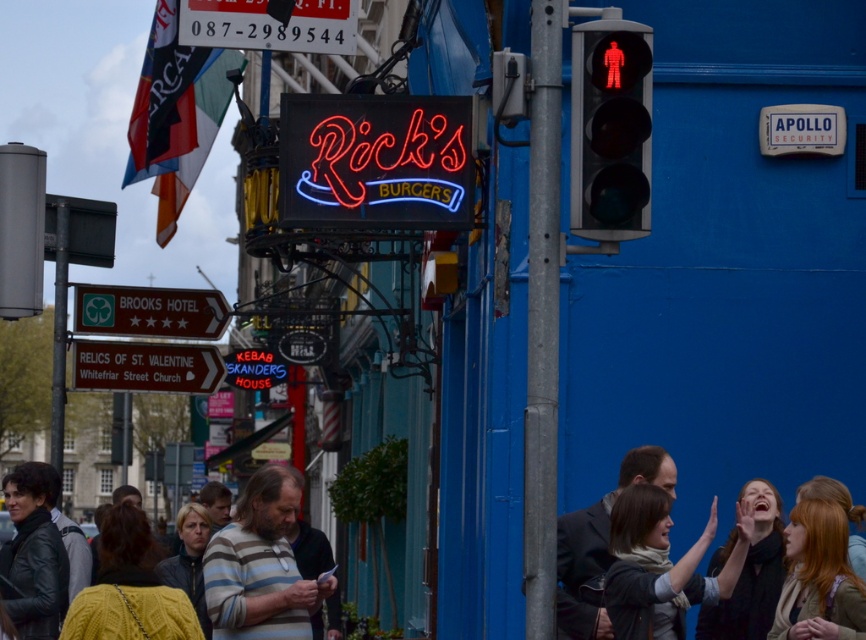
Question: Estimate the real-world distances between objects in this image. Which object is closer to the neontexturedsign at center?

Choices:
 (A) yellow knitted sweater at center
 (B) metallic gray pole at center
 (C) red glass pedestrian signal at right
 (D) neon sign at upper center

Answer: (D)

Question: Does red glass pedestrian signal at right appear on the right side of matte black jacket at center?

Choices:
 (A) no
 (B) yes

Answer: (A)

Question: Which point is farther to the camera?

Choices:
 (A) (553, 509)
 (B) (102, 557)
 (C) (215, 376)
 (D) (466, 211)

Answer: (C)

Question: Which of these objects is positioned farthest from the white wooden sign at lower left?

Choices:
 (A) neon sign at upper center
 (B) red glass pedestrian signal at right

Answer: (B)

Question: From the image, what is the correct spatial relationship of metallic gray pole at center in relation to white wooden sign at lower left?

Choices:
 (A) right
 (B) left

Answer: (A)

Question: Does matte black jacket at center have a lesser width compared to greensignboardbrooks hotel sign at left?

Choices:
 (A) yes
 (B) no

Answer: (A)